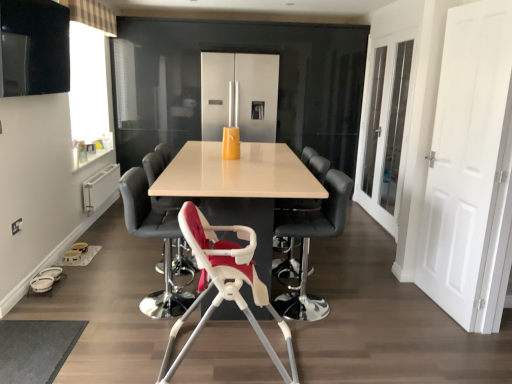
At what (x,y) coordinates should I click in order to perform the action: click on free space in front of white plastic highchair at center, positioned as the 2th chair in front-to-back order. Please return your answer as a coordinate pair (x, y). The height and width of the screenshot is (384, 512). Looking at the image, I should click on (131, 337).